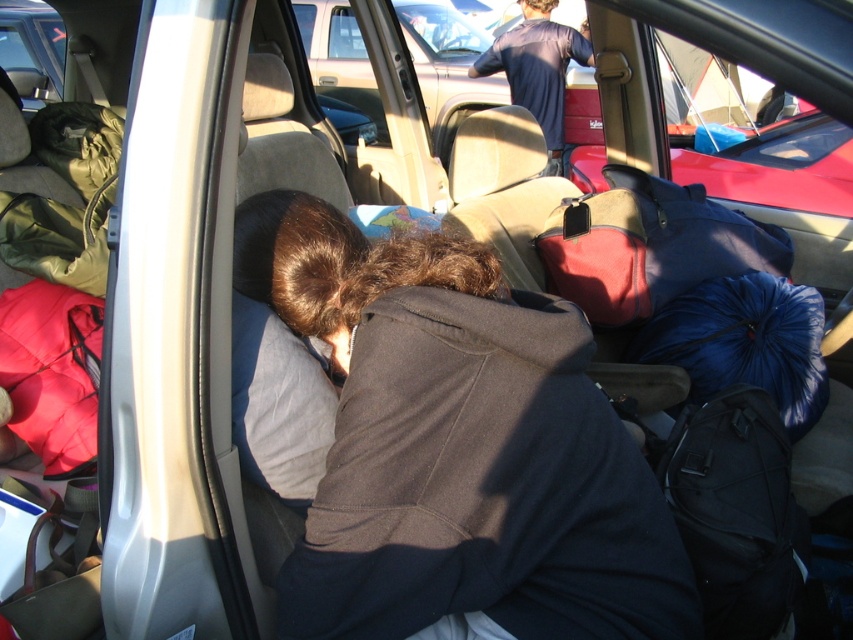
Which is behind, point (358, 490) or point (625, 173)?

The point (625, 173) is more distant.

Is dark gray hoodie at center above blue synthetic sleeping bag at center-right?

No, dark gray hoodie at center is not above blue synthetic sleeping bag at center-right.

Measure the distance between dark gray hoodie at center and camera.

They are 4.27 feet apart.

Locate an element on the screen. dark gray hoodie at center is located at coordinates click(457, 448).

Between point (380, 515) and point (480, 61), which one is positioned behind?

The point (480, 61) is more distant.

Does dark gray hoodie at center appear on the right side of dark blue t-shirt at upper center?

No, dark gray hoodie at center is not to the right of dark blue t-shirt at upper center.

Is point (555, 625) behind point (566, 26)?

No, it is in front of (566, 26).

Where is `dark gray hoodie at center`? This screenshot has height=640, width=853. dark gray hoodie at center is located at coordinates (457, 448).

Is blue synthetic sleeping bag at center-right below dark blue t-shirt at upper center?

Yes, blue synthetic sleeping bag at center-right is below dark blue t-shirt at upper center.

The height and width of the screenshot is (640, 853). In order to click on blue synthetic sleeping bag at center-right in this screenshot , I will do `click(648, 244)`.

Find the location of `blue synthetic sleeping bag at center-right`. blue synthetic sleeping bag at center-right is located at coordinates (648, 244).